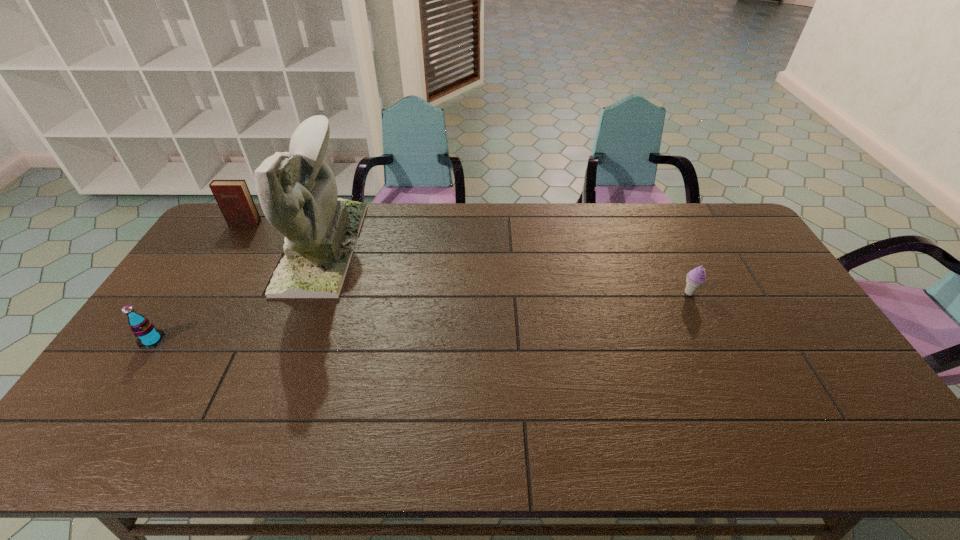
In order to click on free space located on the back of the rightmost object in this screenshot , I will do `click(660, 230)`.

Where is `sculpture that is at the far edge`? The image size is (960, 540). sculpture that is at the far edge is located at coordinates pos(297,190).

I want to click on diary present at the far edge, so click(x=233, y=197).

This screenshot has width=960, height=540. I want to click on diary at the left edge, so click(x=233, y=197).

Find the location of a particular element. soda that is at the left edge is located at coordinates (147, 335).

This screenshot has width=960, height=540. I want to click on object that is at the far left corner, so click(x=233, y=197).

The width and height of the screenshot is (960, 540). In the image, there is a desktop. In order to click on vacant region at the far edge in this screenshot , I will do `click(270, 227)`.

The image size is (960, 540). In the image, there is a desktop. Find the location of `vacant area at the near edge`. vacant area at the near edge is located at coordinates (622, 427).

At what (x,y) coordinates should I click in order to perform the action: click on vacant space at the left edge of the desktop. Please return your answer as a coordinate pair (x, y). The width and height of the screenshot is (960, 540). Looking at the image, I should click on (156, 407).

Identify the location of vacant region at the right edge of the desktop. Image resolution: width=960 pixels, height=540 pixels. (786, 366).